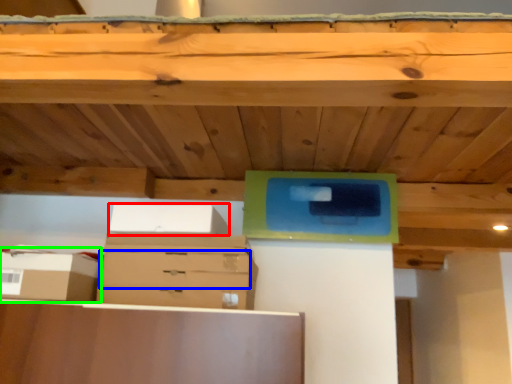
Question: Which object is positioned farthest from storage box (highlighted by a red box)? Select from drawer (highlighted by a blue box) and storage box (highlighted by a green box).

Choices:
 (A) drawer
 (B) storage box

Answer: (B)